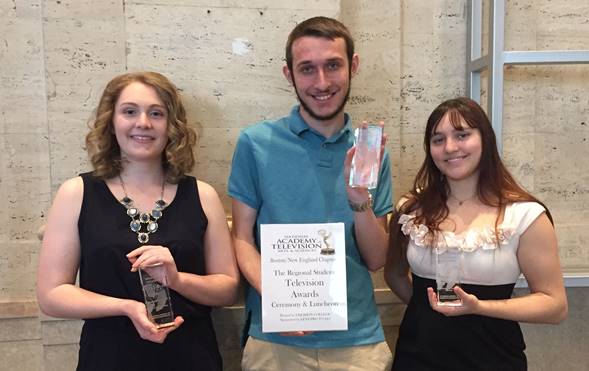
Where is `concrete wall`? concrete wall is located at coordinates (74, 17), (241, 34), (519, 30), (557, 117), (415, 68), (32, 145).